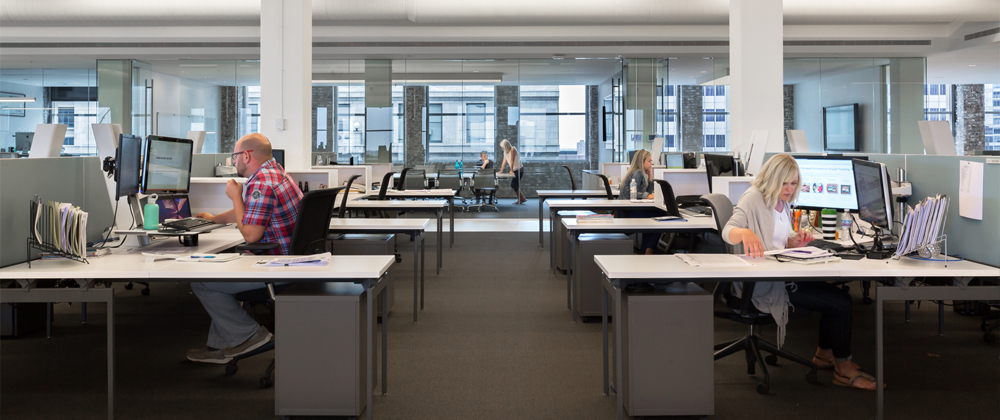
Identify the location of desk chairs. Image resolution: width=1000 pixels, height=420 pixels. (308, 214), (352, 192), (380, 189), (402, 173), (566, 185), (606, 191), (665, 196), (712, 210), (495, 187).